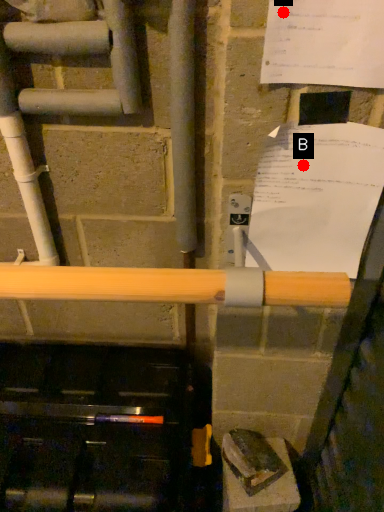
Question: Two points are circled on the image, labeled by A and B beside each circle. Which point is closer to the camera taking this photo?

Choices:
 (A) A is closer
 (B) B is closer

Answer: (A)